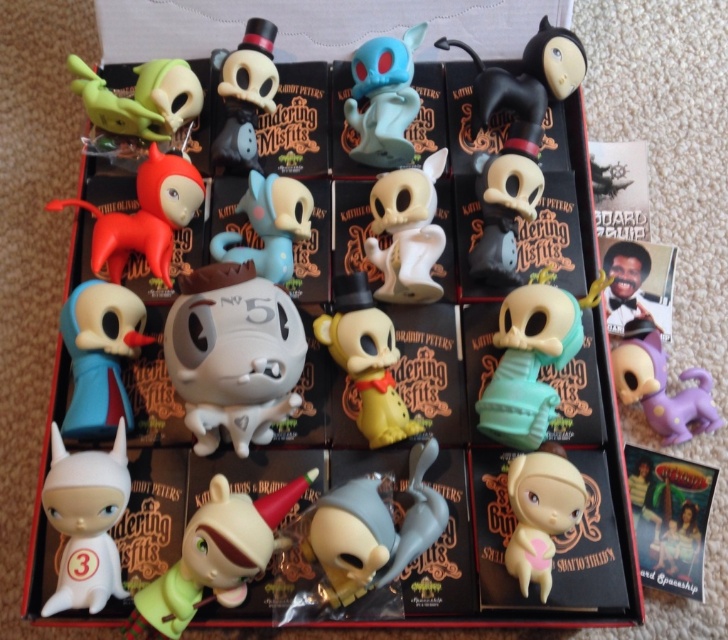
You are packing a box and need to ensure that the matte gray skull at center and the matte blue figurine at center fit side by side without overlapping. Based on their widths, can they both fit if the available space is 30 cm?

The matte gray skull at center might be wider than the matte blue figurine at center, so their combined width might exceed 30 cm. It is uncertain if they can fit without overlapping.

You are organizing a display and want to place a teal matte skeleton at center and a purple matte dog at lower right in a row from left to right. Based on their current positions in the box, which figurine should you move first to achieve this arrangement?

The teal matte skeleton at center is to the left of the purple matte dog at lower right, so to arrange them from left to right, you should move the purple matte dog at lower right to the right side of the teal matte skeleton at center.

You are a collector who wants to place a new figurine between the teal matte skeleton at center and the purple matte dog at lower right. Based on their positions, where should you place the new figurine?

The teal matte skeleton at center is above the purple matte dog at lower right, so you should place the new figurine between them either below the teal matte skeleton at center and above the purple matte dog at lower right to maintain their vertical arrangement.